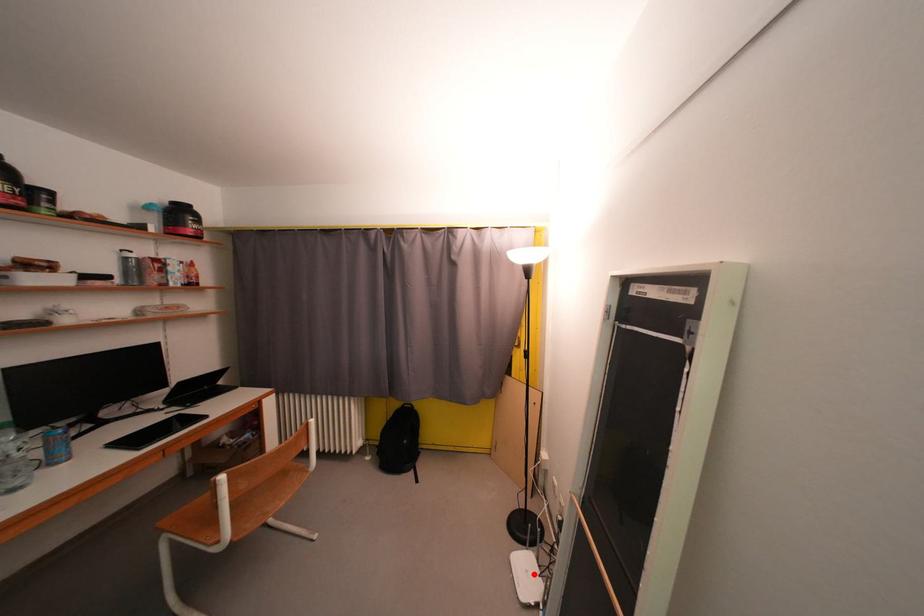
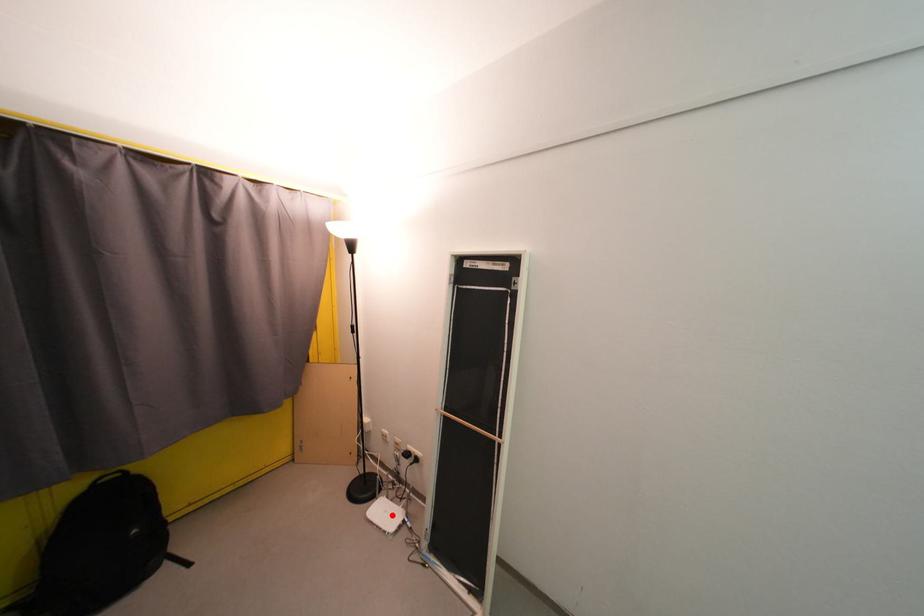
I am providing you with two images of the same scene from different viewpoints. A red point is marked on the first image and another point is marked on the second image. Does the point marked in image1 correspond to the same location as the one in image2?

Yes